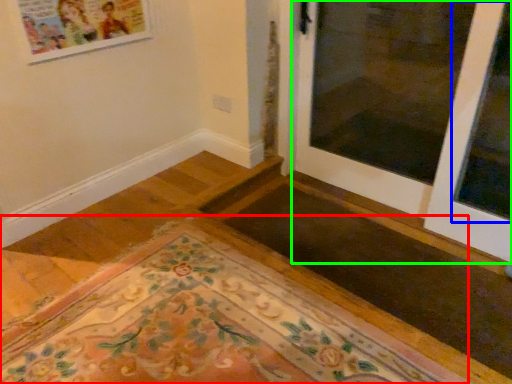
Question: Which object is the closest to the mat (highlighted by a red box)? Choose among these: window (highlighted by a blue box) or door (highlighted by a green box).

Choices:
 (A) window
 (B) door

Answer: (B)